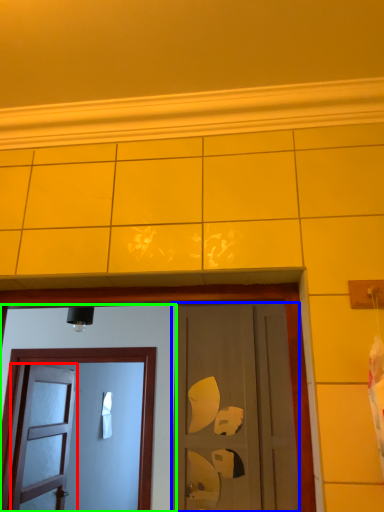
Question: Estimate the real-world distances between objects in this image. Which object is closer to door (highlighted by a red box), door (highlighted by a blue box) or door (highlighted by a green box)?

Choices:
 (A) door
 (B) door

Answer: (B)